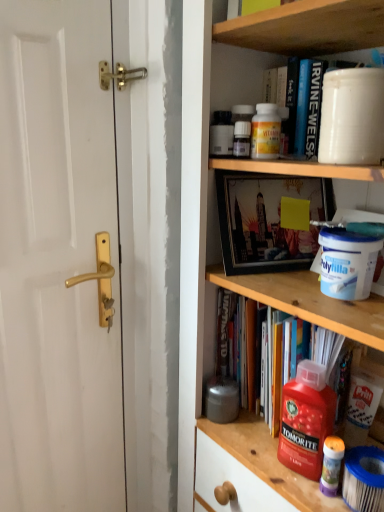
Question: Is wooden shelf at upper center, which is the first cabinet from top to bottom, positioned before white plastic container at upper center, the second cabinet in the top-to-bottom sequence?

Choices:
 (A) no
 (B) yes

Answer: (B)

Question: Is wooden shelf at upper center, which is the 2th cabinet from bottom to top, at the left side of white plastic container at upper center, the first cabinet in the bottom-to-top sequence?

Choices:
 (A) no
 (B) yes

Answer: (B)

Question: Is wooden shelf at upper center, which is the first cabinet from top to bottom, turned away from white plastic container at upper center, the first cabinet in the bottom-to-top sequence?

Choices:
 (A) yes
 (B) no

Answer: (B)

Question: Considering the relative sizes of wooden shelf at upper center, which is the first cabinet from top to bottom, and white plastic container at upper center, the second cabinet in the top-to-bottom sequence, in the image provided, is wooden shelf at upper center, which is the first cabinet from top to bottom, smaller than white plastic container at upper center, the second cabinet in the top-to-bottom sequence,?

Choices:
 (A) no
 (B) yes

Answer: (B)

Question: Does wooden shelf at upper center, which is the first cabinet from top to bottom, have a lesser height compared to white plastic container at upper center, the second cabinet in the top-to-bottom sequence?

Choices:
 (A) no
 (B) yes

Answer: (B)

Question: Considering the positions of wooden shelf at upper center, which is the 2th cabinet from bottom to top, and hardcover book at center in the image, is wooden shelf at upper center, which is the 2th cabinet from bottom to top, wider or thinner than hardcover book at center?

Choices:
 (A) thin
 (B) wide

Answer: (A)

Question: Is point (223, 25) closer or farther from the camera than point (251, 303)?

Choices:
 (A) closer
 (B) farther

Answer: (A)

Question: In terms of height, does wooden shelf at upper center, which is the 2th cabinet from bottom to top, look taller or shorter compared to hardcover book at center?

Choices:
 (A) tall
 (B) short

Answer: (B)

Question: From a real-world perspective, is wooden shelf at upper center, which is the first cabinet from top to bottom, above or below hardcover book at center?

Choices:
 (A) above
 (B) below

Answer: (A)

Question: Is point (223, 134) positioned closer to the camera than point (261, 71)?

Choices:
 (A) farther
 (B) closer

Answer: (B)

Question: Is matte black bottle at upper center to the left or to the right of white plastic container at upper center, the second cabinet in the top-to-bottom sequence, in the image?

Choices:
 (A) right
 (B) left

Answer: (B)

Question: From a real-world perspective, relative to white plastic container at upper center, the second cabinet in the top-to-bottom sequence, is matte black bottle at upper center vertically above or below?

Choices:
 (A) above
 (B) below

Answer: (B)

Question: Based on their sizes in the image, would you say matte black bottle at upper center is bigger or smaller than white plastic container at upper center, the second cabinet in the top-to-bottom sequence?

Choices:
 (A) small
 (B) big

Answer: (A)

Question: From the image's perspective, is white plastic container at upper center, the second cabinet in the top-to-bottom sequence, above or below white glossy door handle at left?

Choices:
 (A) below
 (B) above

Answer: (B)

Question: Is white plastic container at upper center, the second cabinet in the top-to-bottom sequence, wider or thinner than white glossy door handle at left?

Choices:
 (A) wide
 (B) thin

Answer: (A)